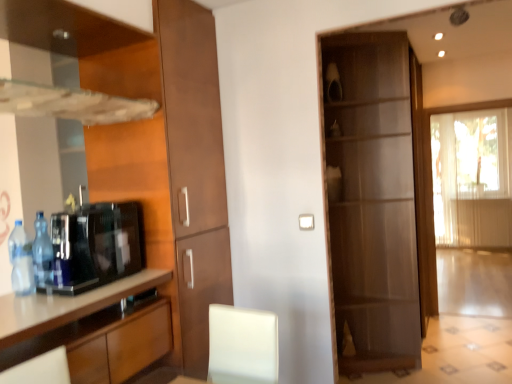
Question: From a real-world perspective, is blue plastic bottle at left, which is the first bottle in front-to-back order, on black glossy coffee machine at lower left?

Choices:
 (A) no
 (B) yes

Answer: (A)

Question: From the image's perspective, does blue plastic bottle at left, which is the first bottle in front-to-back order, appear higher than black glossy coffee machine at lower left?

Choices:
 (A) no
 (B) yes

Answer: (A)

Question: Can we say blue plastic bottle at left, marked as the second bottle in a back-to-front arrangement, lies outside black glossy coffee machine at lower left?

Choices:
 (A) no
 (B) yes

Answer: (A)

Question: From a real-world perspective, is blue plastic bottle at left, which is the first bottle in front-to-back order, physically below black glossy coffee machine at lower left?

Choices:
 (A) yes
 (B) no

Answer: (A)

Question: Considering the relative sizes of blue plastic bottle at left, marked as the second bottle in a back-to-front arrangement, and black glossy coffee machine at lower left in the image provided, is blue plastic bottle at left, marked as the second bottle in a back-to-front arrangement, wider than black glossy coffee machine at lower left?

Choices:
 (A) yes
 (B) no

Answer: (B)

Question: Considering the relative positions of blue plastic bottle at left, the second bottle when ordered from front to back, and brown wood cabinet at left, arranged as the second cabinetry when viewed from the back, in the image provided, is blue plastic bottle at left, the second bottle when ordered from front to back, to the left or to the right of brown wood cabinet at left, arranged as the second cabinetry when viewed from the back,?

Choices:
 (A) left
 (B) right

Answer: (A)

Question: Is blue plastic bottle at left, the second bottle when ordered from front to back, taller or shorter than brown wood cabinet at left, arranged as the second cabinetry when viewed from the back?

Choices:
 (A) tall
 (B) short

Answer: (B)

Question: Is blue plastic bottle at left, which is counted as the first bottle, starting from the back, wider or thinner than brown wood cabinet at left, positioned as the first cabinetry in front-to-back order?

Choices:
 (A) wide
 (B) thin

Answer: (B)

Question: Is blue plastic bottle at left, which is counted as the first bottle, starting from the back, in front of or behind brown wood cabinet at left, positioned as the first cabinetry in front-to-back order, in the image?

Choices:
 (A) front
 (B) behind

Answer: (B)

Question: Considering the positions of point (488, 142) and point (38, 243), is point (488, 142) closer or farther from the camera than point (38, 243)?

Choices:
 (A) closer
 (B) farther

Answer: (B)

Question: Considering the positions of translucent fabric curtain at right and blue plastic bottle at left, the second bottle when ordered from front to back, in the image, is translucent fabric curtain at right taller or shorter than blue plastic bottle at left, the second bottle when ordered from front to back,?

Choices:
 (A) short
 (B) tall

Answer: (B)

Question: In the image, is translucent fabric curtain at right positioned in front of or behind blue plastic bottle at left, which is counted as the first bottle, starting from the back?

Choices:
 (A) front
 (B) behind

Answer: (B)

Question: In terms of width, does translucent fabric curtain at right look wider or thinner when compared to blue plastic bottle at left, the second bottle when ordered from front to back?

Choices:
 (A) thin
 (B) wide

Answer: (B)

Question: Considering the positions of translucent fabric curtain at right and blue plastic bottle at left, marked as the second bottle in a back-to-front arrangement, in the image, is translucent fabric curtain at right taller or shorter than blue plastic bottle at left, marked as the second bottle in a back-to-front arrangement,?

Choices:
 (A) short
 (B) tall

Answer: (B)

Question: Would you say translucent fabric curtain at right is inside or outside blue plastic bottle at left, marked as the second bottle in a back-to-front arrangement?

Choices:
 (A) outside
 (B) inside

Answer: (A)